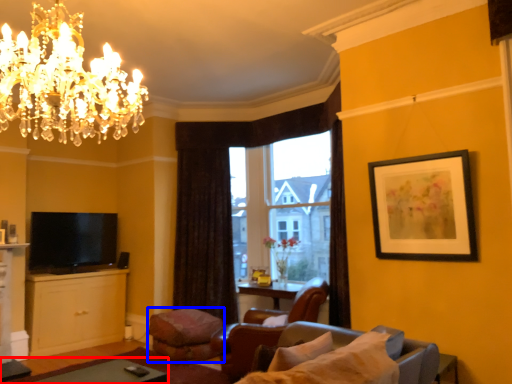
Question: Which of the following is the farthest to the observer, table (highlighted by a red box) or footrest (highlighted by a blue box)?

Choices:
 (A) table
 (B) footrest

Answer: (B)